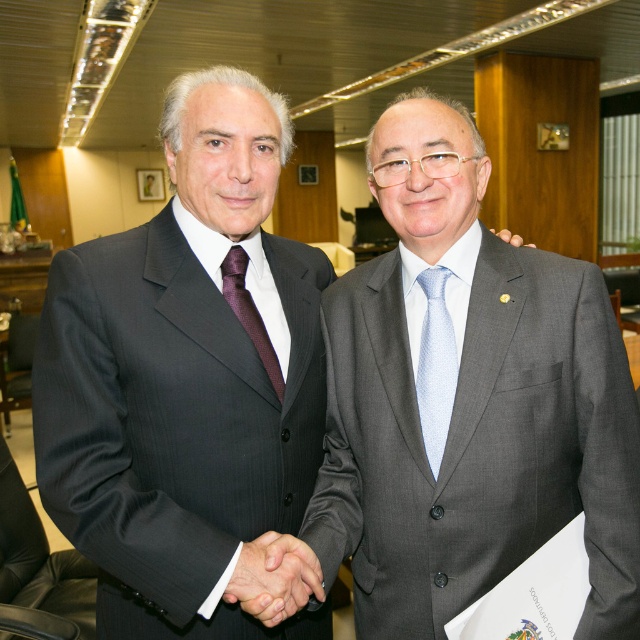
Can you confirm if dark gray pinstripe suit at left is smaller than light blue textured tie at center?

No, dark gray pinstripe suit at left is not smaller than light blue textured tie at center.

Is point (125, 632) positioned after point (440, 288)?

No, (125, 632) is closer to viewer.

Measure the distance between dark gray pinstripe suit at left and camera.

A distance of 36.77 inches exists between dark gray pinstripe suit at left and camera.

I want to click on dark gray pinstripe suit at left, so click(x=173, y=426).

Is the position of matte black suit at center less distant than that of matte black hand at upper center?

That is True.

Is point (86, 436) behind point (509, 232)?

No, (86, 436) is in front of (509, 232).

Does point (272, 182) lie behind point (516, 244)?

That is False.

This screenshot has height=640, width=640. In order to click on matte black suit at center in this screenshot , I will do `click(182, 380)`.

Is gray matte suit at center positioned at the back of dark gray pinstripe suit at left?

Yes, it is behind dark gray pinstripe suit at left.

Identify the location of gray matte suit at center. The width and height of the screenshot is (640, 640). (468, 403).

The width and height of the screenshot is (640, 640). Find the location of `gray matte suit at center`. gray matte suit at center is located at coordinates (468, 403).